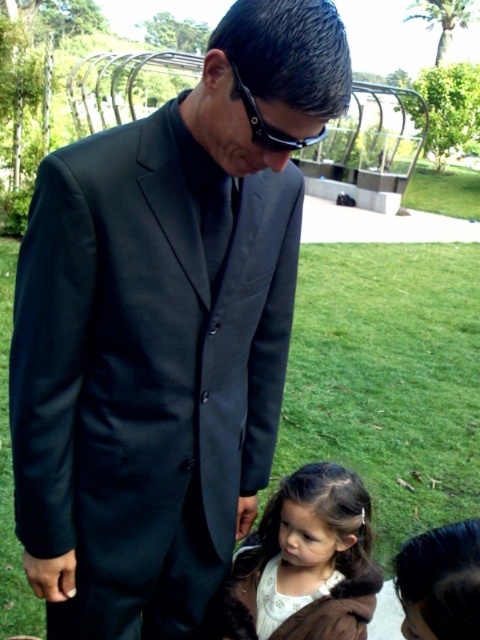
You are a photographer trying to capture the man in the black suit and the white fur coat at lower center. Where exactly should you focus your camera to ensure both are in the frame?

You should focus your camera at point (308, 560) where the white fur coat at lower center is located to include both the man in the black suit and the coat in the frame.

In the scene shown: You are a photographer standing at the camera position. You want to take a closeup photo of the white fur coat at lower center. Can you reach it with your 1.5 meter long selfie stick?

The white fur coat at lower center is 1.55 meters away from the camera. Since the selfie stick is only 1.5 meters long, it is just slightly too short to reach the coat. You would need a slightly longer extension or take a step closer.